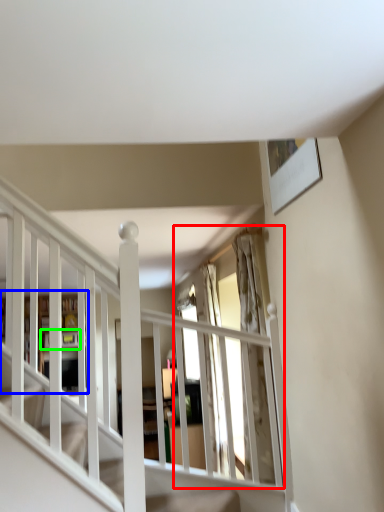
Question: Considering the real-world distances, which object is farthest from window (highlighted by a red box)? bookshelf (highlighted by a blue box) or shelf (highlighted by a green box)?

Choices:
 (A) bookshelf
 (B) shelf

Answer: (B)